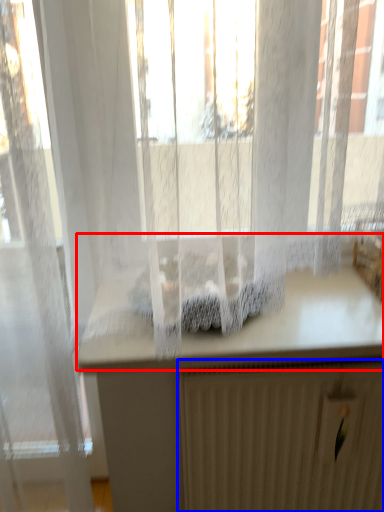
Question: Among these objects, which one is nearest to the camera, counter top (highlighted by a red box) or radiator (highlighted by a blue box)?

Choices:
 (A) counter top
 (B) radiator

Answer: (A)